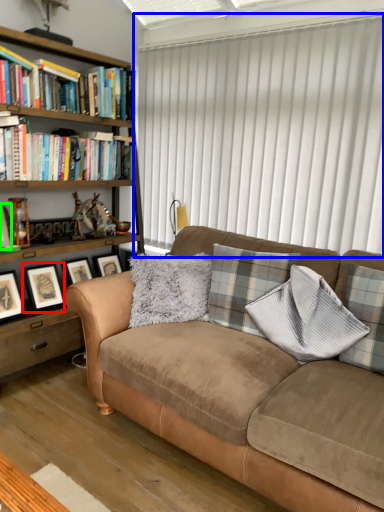
Question: Which is farther away from picture frame (highlighted by a red box)? window blind (highlighted by a blue box) or picture frame (highlighted by a green box)?

Choices:
 (A) window blind
 (B) picture frame

Answer: (A)